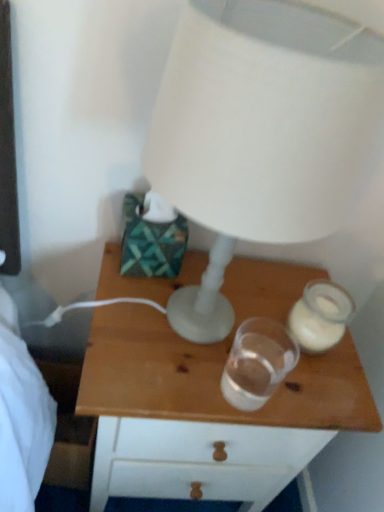
Identify the location of vacant space in front of translucent glass candle holder at right, the first candle holder in the right-to-left sequence. Image resolution: width=384 pixels, height=512 pixels. (297, 386).